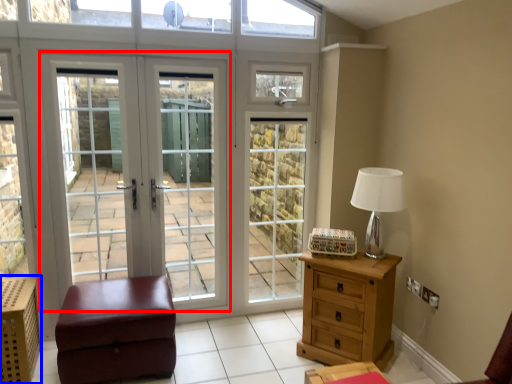
Question: Which object appears farthest to the camera in this image, door (highlighted by a red box) or crate (highlighted by a blue box)?

Choices:
 (A) door
 (B) crate

Answer: (A)